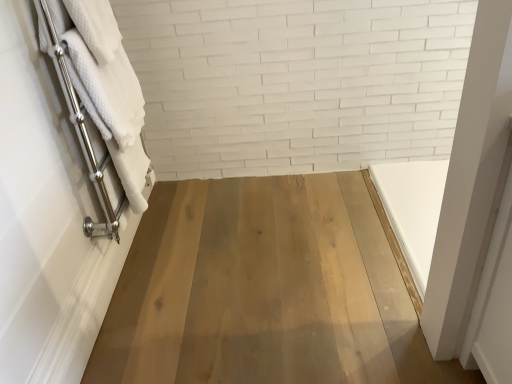
Question: In terms of height, does white textured towel at left, the 1th bath towel positioned from the bottom, look taller or shorter compared to white textured towel at left, acting as the first bath towel starting from the top?

Choices:
 (A) tall
 (B) short

Answer: (A)

Question: Looking at the image, does white textured towel at left, placed as the second bath towel when sorted from top to bottom, seem bigger or smaller compared to white textured towel at left, acting as the first bath towel starting from the top?

Choices:
 (A) big
 (B) small

Answer: (A)

Question: Considering the relative positions of white textured towel at left, the 1th bath towel positioned from the bottom, and white textured towel at left, which appears as the 2th bath towel when ordered from the bottom, in the image provided, is white textured towel at left, the 1th bath towel positioned from the bottom, to the left or to the right of white textured towel at left, which appears as the 2th bath towel when ordered from the bottom,?

Choices:
 (A) left
 (B) right

Answer: (A)

Question: Considering the positions of point (96, 107) and point (117, 77), is point (96, 107) closer or farther from the camera than point (117, 77)?

Choices:
 (A) closer
 (B) farther

Answer: (A)

Question: Relative to white textured towel at left, placed as the second bath towel when sorted from top to bottom, is white textured towel at left, which appears as the 2th bath towel when ordered from the bottom, in front or behind?

Choices:
 (A) front
 (B) behind

Answer: (B)

Question: From the image's perspective, is white textured towel at left, acting as the first bath towel starting from the top, positioned above or below white textured towel at left, the 1th bath towel positioned from the bottom?

Choices:
 (A) below
 (B) above

Answer: (B)

Question: Choose the correct answer: Is white textured towel at left, which appears as the 2th bath towel when ordered from the bottom, inside white textured towel at left, the 1th bath towel positioned from the bottom, or outside it?

Choices:
 (A) inside
 (B) outside

Answer: (A)